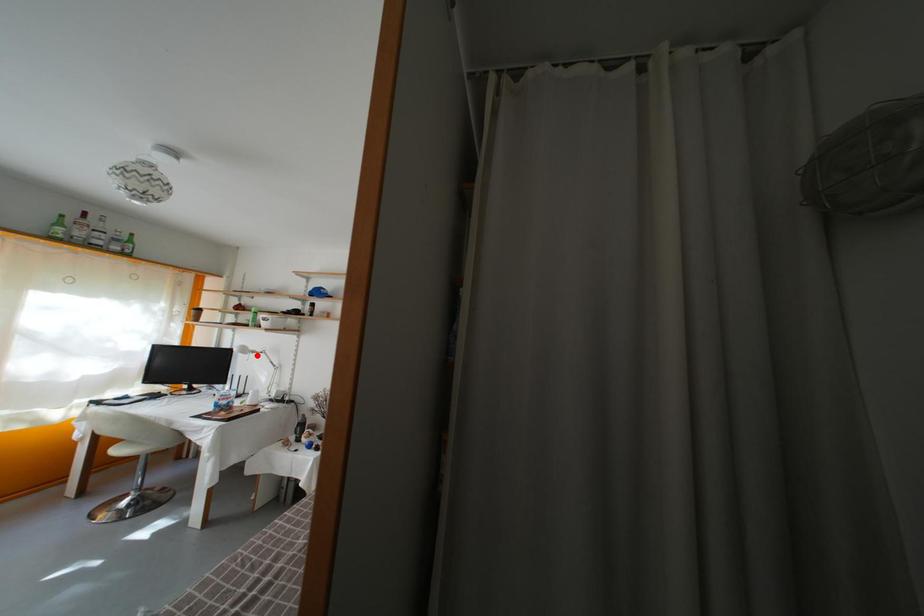
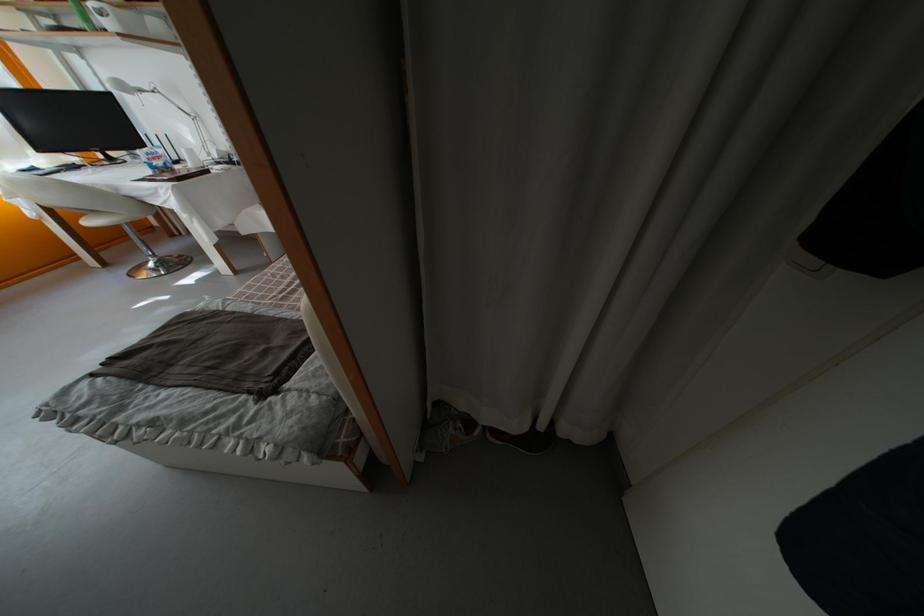
Locate, in the second image, the point that corresponds to the highlighted location in the first image.

(139, 91)